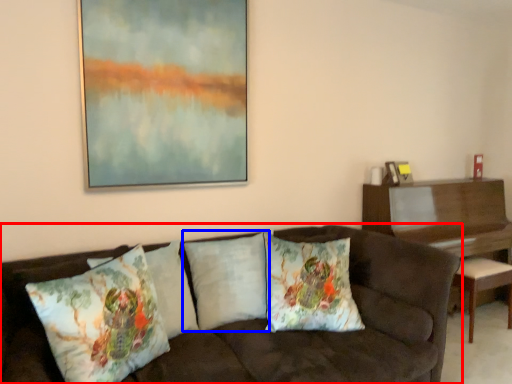
Question: Among these objects, which one is nearest to the camera, studio couch (highlighted by a red box) or pillow (highlighted by a blue box)?

Choices:
 (A) studio couch
 (B) pillow

Answer: (A)